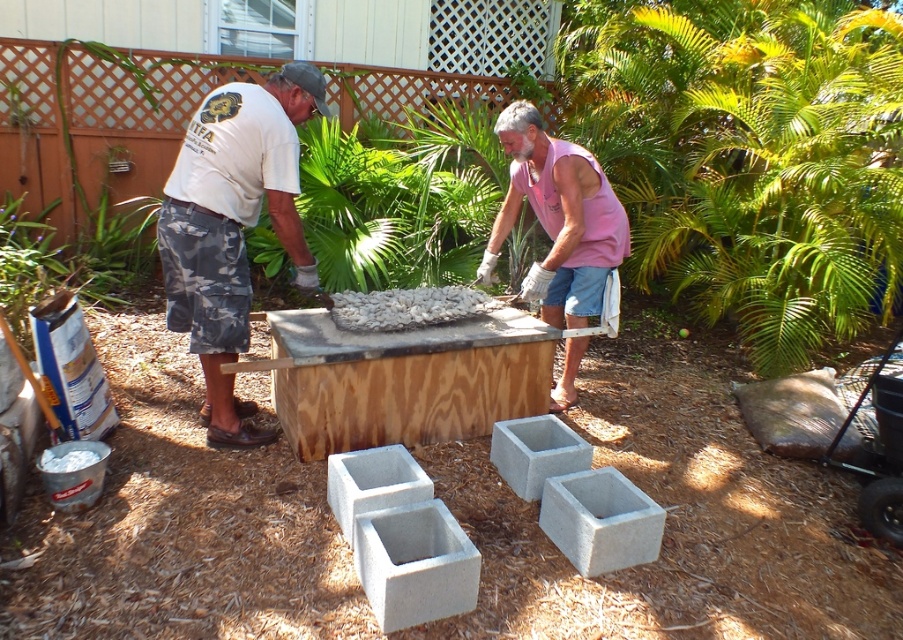
Is white cotton shirt at upper left to the left of gray concrete block at center from the viewer's perspective?

Indeed, white cotton shirt at upper left is positioned on the left side of gray concrete block at center.

Which is behind, point (185, 228) or point (599, 490)?

The point (185, 228) is behind.

Which is behind, point (213, 438) or point (582, 493)?

Positioned behind is point (213, 438).

Find the location of a particular element. white cotton shirt at upper left is located at coordinates (234, 227).

Locate an element on the screen. The height and width of the screenshot is (640, 903). white matte t-shirt at center is located at coordinates (233, 227).

Is point (244, 292) positioned after point (563, 488)?

That is True.

The width and height of the screenshot is (903, 640). What do you see at coordinates (233, 227) in the screenshot?
I see `white matte t-shirt at center` at bounding box center [233, 227].

Locate an element on the screen. white matte t-shirt at center is located at coordinates (233, 227).

Does point (321, 113) come farther from viewer compared to point (233, 339)?

Yes, it is behind point (233, 339).

Consider the image. Between white cotton shirt at upper left and white matte t-shirt at center, which one appears on the left side from the viewer's perspective?

white matte t-shirt at center is more to the left.

Locate an element on the screen. This screenshot has height=640, width=903. white cotton shirt at upper left is located at coordinates 234,227.

Identify the location of white cotton shirt at upper left. (234, 227).